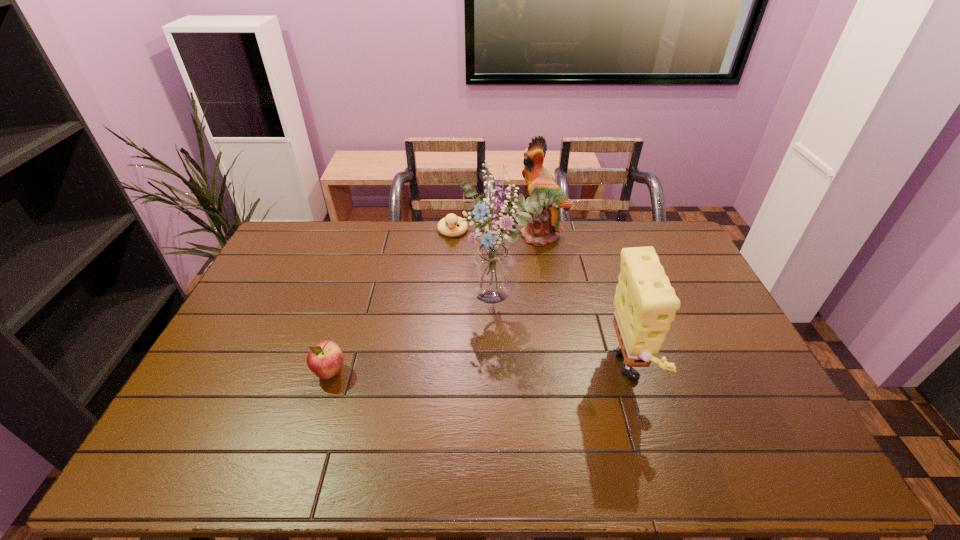
The height and width of the screenshot is (540, 960). Find the location of `free space between the sponge and the leftmost object`. free space between the sponge and the leftmost object is located at coordinates (482, 373).

Find the location of `vacant region between the parrot and the third shortest object`. vacant region between the parrot and the third shortest object is located at coordinates (588, 304).

You are a GUI agent. You are given a task and a screenshot of the screen. Output one action in this format:
    pyautogui.click(x=<x>, y=<y>)
    Task: Click on the vacant area that lies between the parrot and the bouquet
    The width and height of the screenshot is (960, 540).
    Given the screenshot: What is the action you would take?
    pyautogui.click(x=522, y=265)

The height and width of the screenshot is (540, 960). Identify the location of free space between the third tallest object and the second shortest object. (482, 373).

Select which object appears as the closest to the leftmost object. Please provide its 2D coordinates. Your answer should be formatted as a tuple, i.e. [(x, y)], where the tuple contains the x and y coordinates of a point satisfying the conditions above.

[(492, 270)]

You are a GUI agent. You are given a task and a screenshot of the screen. Output one action in this format:
    pyautogui.click(x=<x>, y=<y>)
    Task: Click on the object that stands as the second closest to the duckling
    Image resolution: width=960 pixels, height=540 pixels.
    Given the screenshot: What is the action you would take?
    pyautogui.click(x=542, y=230)

This screenshot has height=540, width=960. I want to click on vacant space that satisfies the following two spatial constraints: 1. on the front side of the leftmost object; 2. on the face of the third tallest object, so click(x=330, y=373).

Identify the location of free region that satisfies the following two spatial constraints: 1. on the front side of the bouquet; 2. on the face of the third tallest object. Image resolution: width=960 pixels, height=540 pixels. (507, 373).

Locate an element on the screen. This screenshot has height=540, width=960. vacant space that satisfies the following two spatial constraints: 1. on the front side of the bouquet; 2. on the face of the rightmost object is located at coordinates (507, 373).

The width and height of the screenshot is (960, 540). I want to click on free space that satisfies the following two spatial constraints: 1. on the front side of the rightmost object; 2. on the face of the fourth shortest object, so click(x=568, y=373).